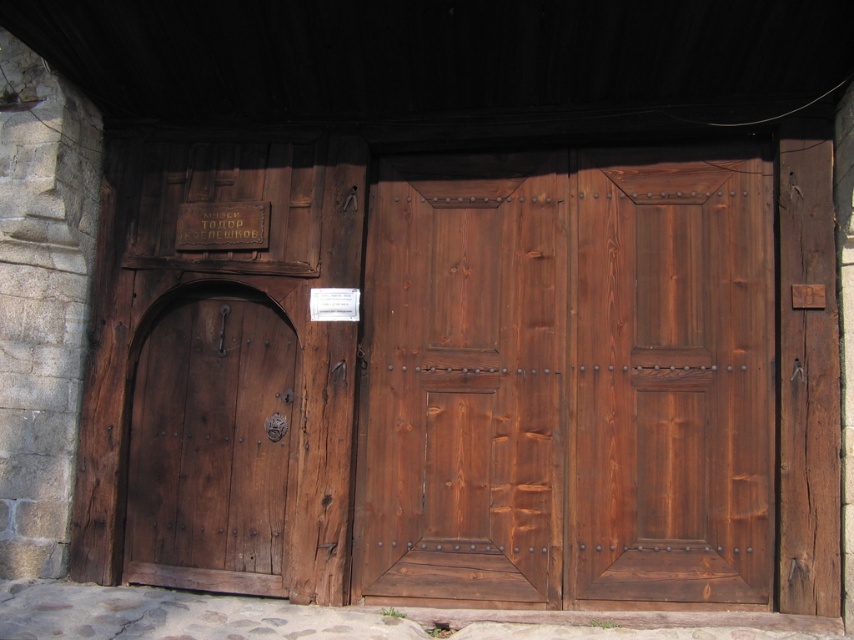
You are a delivery person trying to deliver a package to a house with two doors. The stained wood door at center is the main entrance, and the satin brown wood door at center is the side entrance. The package can only be delivered through the main entrance. However, there is a 7.37 inches gap between the two doors. If your delivery cart is 8 inches wide, can you maneuver through the gap between the two doors to reach the main entrance?

The distance between the stained wood door at center and the satin brown wood door at center is 7.37 inches. Since your delivery cart is 8 inches wide, which is wider than the gap, you cannot maneuver through the gap between the two doors to reach the main entrance.

You are standing in front of two doors. The first is the satin wood door at center, and the second is the satin brown wood door at center. Which door is positioned to the right of the other?

The satin brown wood door at center is positioned to the right of the satin wood door at center.